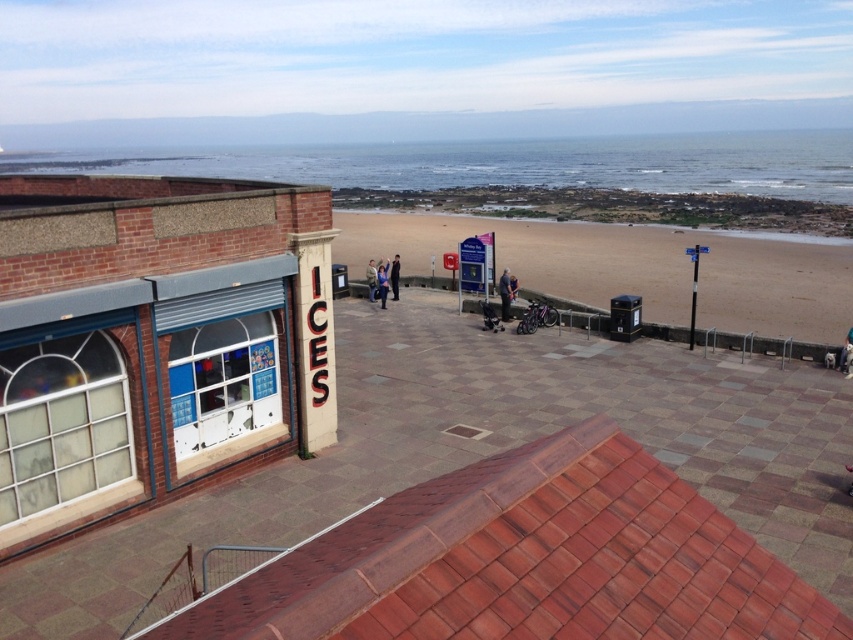
From the picture: You are standing at the rooftop viewpoint looking out. There is a point marked at coordinates (509, 163). What does this point indicate?

The point at coordinates (509, 163) corresponds to the blue water at upper center.

You are standing at the point with coordinates point (514,180) and want to walk to the beach. There is an obstacle at point (505,285). Will you be able to see the beach clearly from your starting position?

Point (514,180) is behind point (505,285), so the obstacle at point (505,285) will block your view of the beach from your starting position.

You are standing on the rooftop and looking down at the scene below. You see brown sand at center and dark blue jeans at center. Which object covers a bigger area in the image?

The brown sand at center is larger in size than the dark blue jeans at center, so it covers a bigger area in the image.